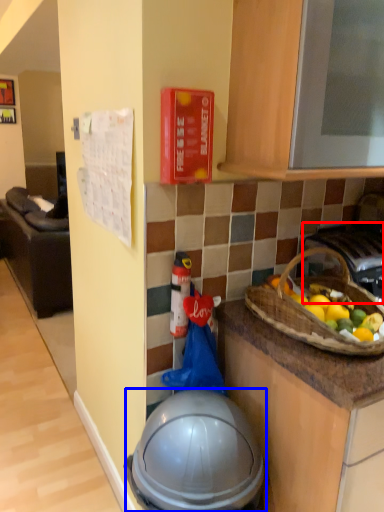
Question: Which object is closer to the camera taking this photo, gas stove (highlighted by a red box) or helmet (highlighted by a blue box)?

Choices:
 (A) gas stove
 (B) helmet

Answer: (B)